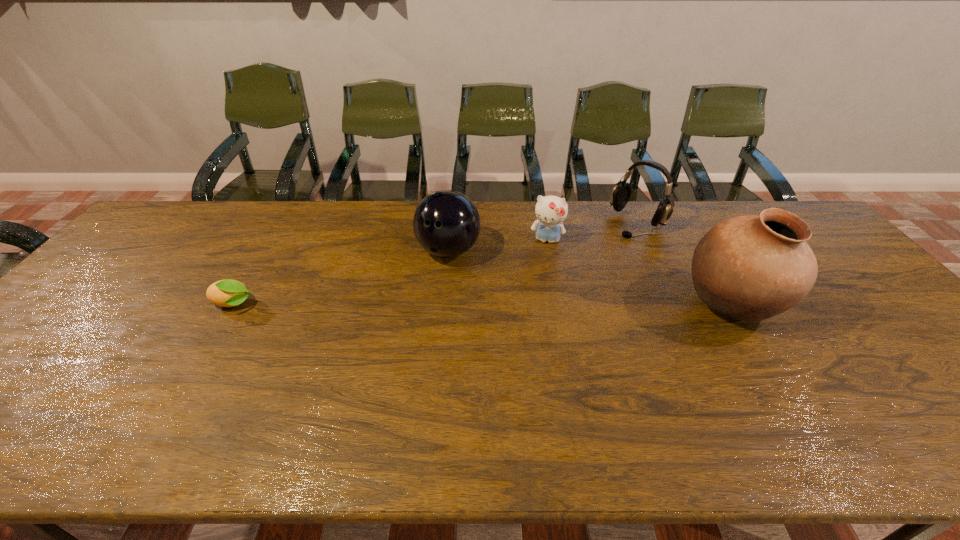
Identify the location of vacant space located 0.200m on the front-facing side of the kitten. This screenshot has height=540, width=960. (536, 291).

Identify the location of vacant area situated on the front-facing side of the kitten. Image resolution: width=960 pixels, height=540 pixels. [535, 296].

In order to click on vacant area situated 0.070m with the microphone on the side of the headset in this screenshot , I will do `click(613, 245)`.

Where is `free space located with the microphone on the side of the headset`? The width and height of the screenshot is (960, 540). free space located with the microphone on the side of the headset is located at coordinates (575, 279).

At what (x,y) coordinates should I click in order to perform the action: click on vacant area situated 0.340m with the microphone on the side of the headset. Please return your answer as a coordinate pair (x, y). The height and width of the screenshot is (540, 960). Looking at the image, I should click on (565, 287).

Where is `vacant space located 0.310m on the side of the second object from left to right with the finger holes`? vacant space located 0.310m on the side of the second object from left to right with the finger holes is located at coordinates (403, 352).

You are a GUI agent. You are given a task and a screenshot of the screen. Output one action in this format:
    pyautogui.click(x=<x>, y=<y>)
    Task: Click on the vacant space positioned on the side of the second object from left to right with the finger holes
    This screenshot has width=960, height=540.
    Given the screenshot: What is the action you would take?
    pyautogui.click(x=418, y=319)

You are a GUI agent. You are given a task and a screenshot of the screen. Output one action in this format:
    pyautogui.click(x=<x>, y=<y>)
    Task: Click on the free space located 0.340m on the side of the second object from left to right with the finger holes
    This screenshot has height=540, width=960.
    Given the screenshot: What is the action you would take?
    pyautogui.click(x=399, y=361)

The height and width of the screenshot is (540, 960). Find the location of `kitten present at the far edge`. kitten present at the far edge is located at coordinates (551, 211).

Find the location of `headset positioned at the far edge`. headset positioned at the far edge is located at coordinates (621, 193).